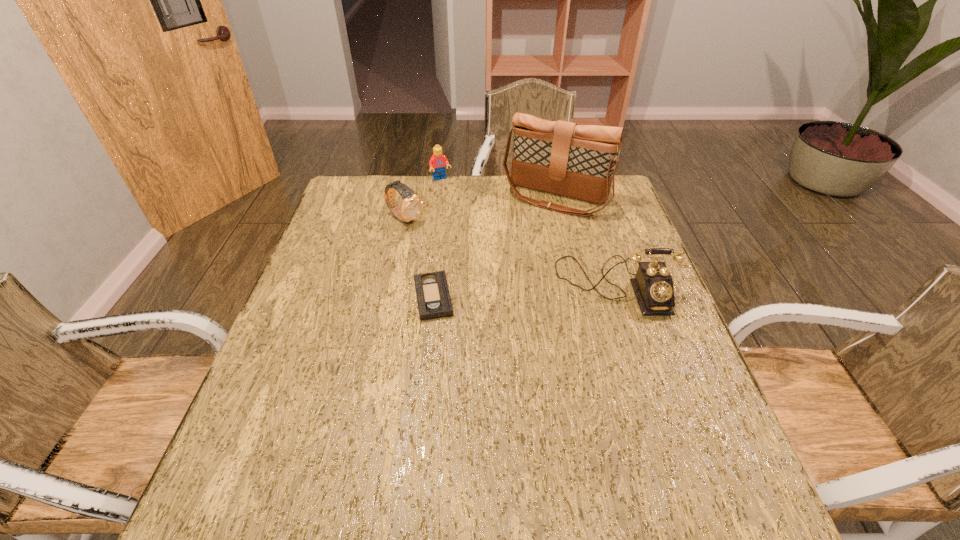
Image resolution: width=960 pixels, height=540 pixels. I want to click on free space on the desktop that is between the shortest object and the telephone and is positioned on the face of the watch, so click(523, 292).

Identify the location of vacant space on the desktop that is between the videotape and the telephone and is positioned on the face of the Lego. This screenshot has height=540, width=960. (512, 292).

You are a GUI agent. You are given a task and a screenshot of the screen. Output one action in this format:
    pyautogui.click(x=<x>, y=<y>)
    Task: Click on the vacant space on the desktop that is between the shortest object and the telephone and is positioned on the front-facing side of the shoulder bag
    Image resolution: width=960 pixels, height=540 pixels.
    Given the screenshot: What is the action you would take?
    pyautogui.click(x=501, y=293)